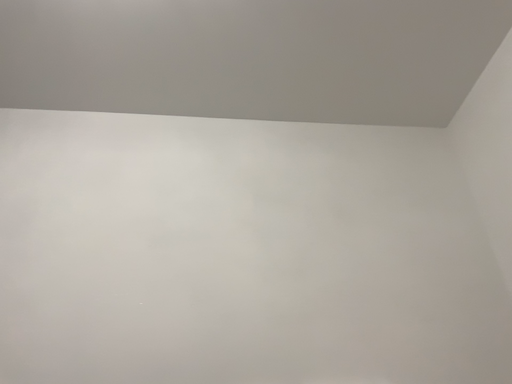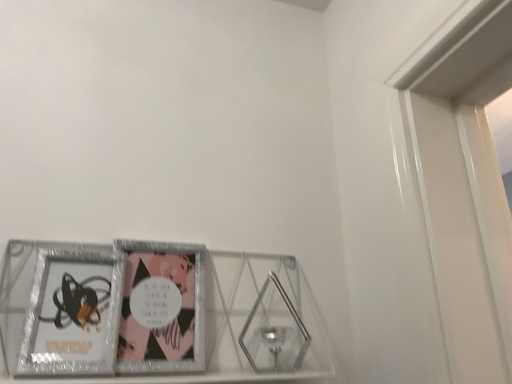
Question: How did the camera likely rotate when shooting the video?

Choices:
 (A) rotated left
 (B) rotated right

Answer: (B)